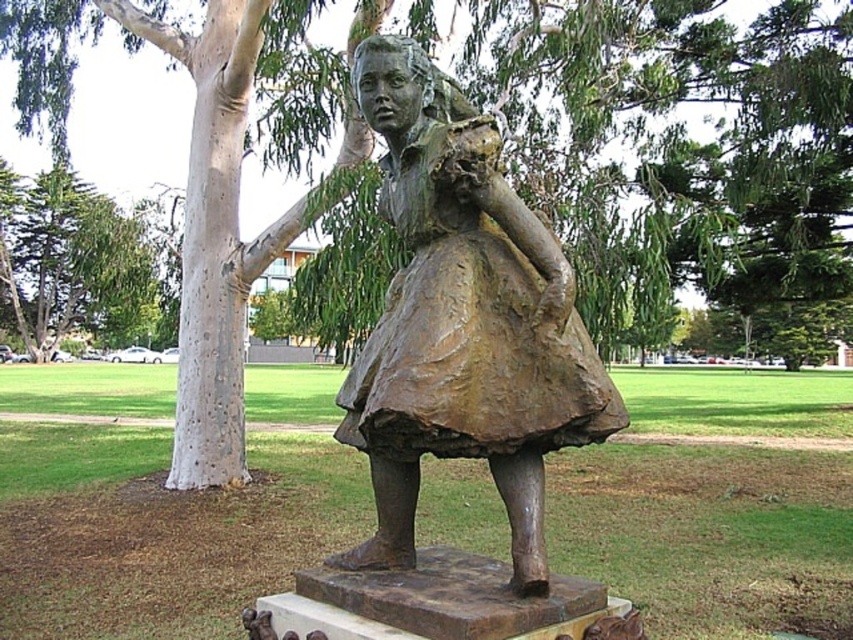
Looking at this image, is bronze statue at center above green leafy tree at left?

No.

Which is more to the right, bronze statue at center or green leafy tree at left?

bronze statue at center

Where is `bronze statue at center`? This screenshot has height=640, width=853. bronze statue at center is located at coordinates (462, 324).

Find the location of `bronze statue at center`. bronze statue at center is located at coordinates (462, 324).